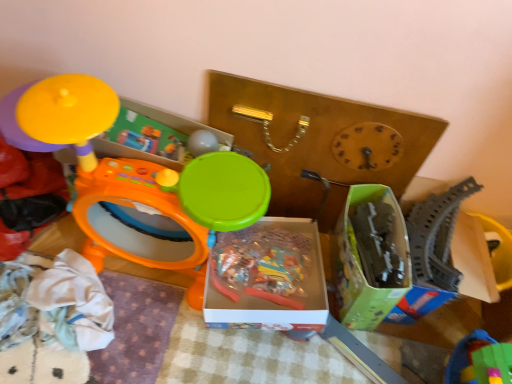
Where is `unoccupied area in front of green cardboard box at center-right, the 1th storage box when ordered from right to left`? The image size is (512, 384). unoccupied area in front of green cardboard box at center-right, the 1th storage box when ordered from right to left is located at coordinates (343, 359).